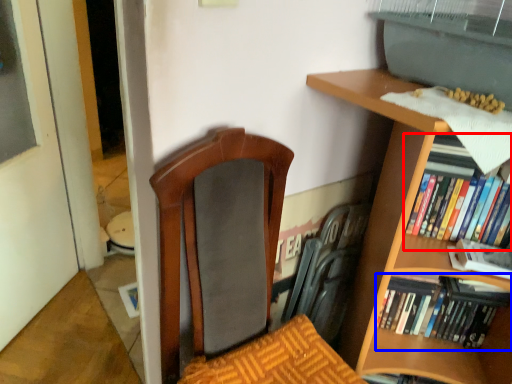
Question: Which of the following is the farthest to the observer, book (highlighted by a red box) or book (highlighted by a blue box)?

Choices:
 (A) book
 (B) book

Answer: (B)